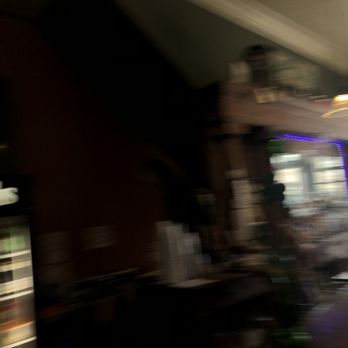
The height and width of the screenshot is (348, 348). What are the coordinates of `ceiling` in the screenshot? It's located at (321, 10).